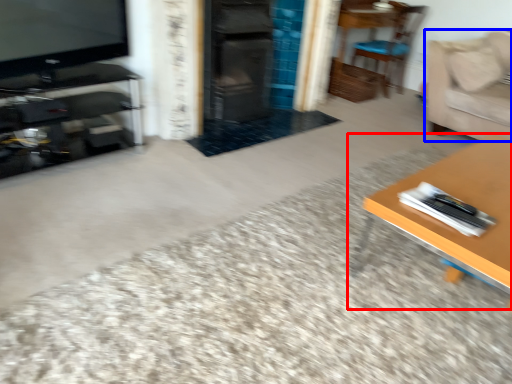
Question: Which object appears closest to the camera in this image, table (highlighted by a red box) or couch (highlighted by a blue box)?

Choices:
 (A) table
 (B) couch

Answer: (A)